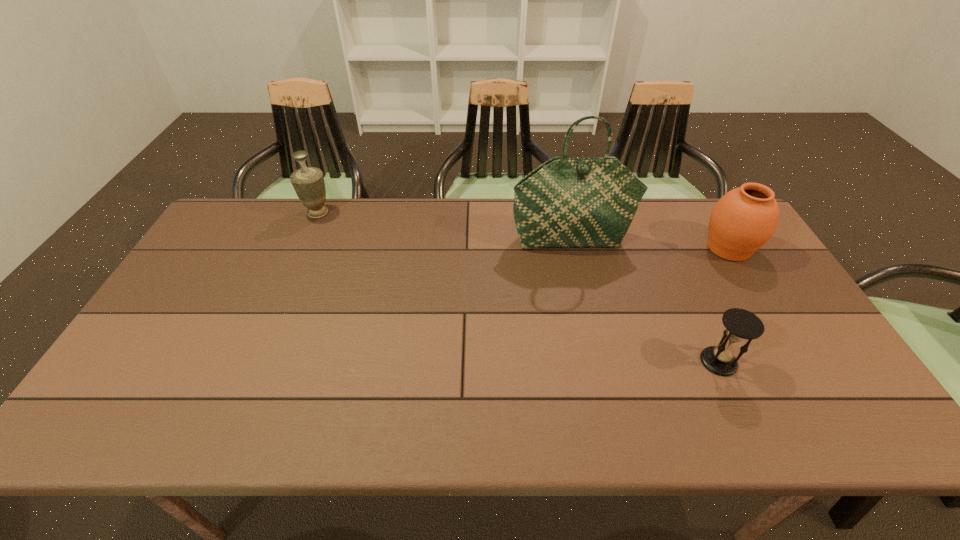
Where is `free space located on the front of the right urn`? This screenshot has width=960, height=540. free space located on the front of the right urn is located at coordinates (777, 328).

At what (x,y) coordinates should I click in order to perform the action: click on free region located on the left of the shortest object. Please return your answer as a coordinate pair (x, y). The height and width of the screenshot is (540, 960). Looking at the image, I should click on (677, 362).

Identify the location of tote bag that is at the far edge. (566, 202).

You are a GUI agent. You are given a task and a screenshot of the screen. Output one action in this format:
    pyautogui.click(x=<x>, y=<y>)
    Task: Click on the object positioned at the right edge
    This screenshot has width=960, height=540.
    Given the screenshot: What is the action you would take?
    pyautogui.click(x=744, y=219)

I want to click on object at the far right corner, so click(x=744, y=219).

Where is `vacant area at the far edge`? The width and height of the screenshot is (960, 540). vacant area at the far edge is located at coordinates (493, 221).

In the image, there is a desktop. At what (x,y) coordinates should I click in order to perform the action: click on vacant region at the near edge. Please return your answer as a coordinate pair (x, y). Image resolution: width=960 pixels, height=540 pixels. Looking at the image, I should click on (441, 406).

Find the location of a particular element. vacant space at the left edge of the desktop is located at coordinates point(251,244).

In the image, there is a desktop. Where is `vacant region at the right edge`? vacant region at the right edge is located at coordinates (774, 309).

This screenshot has height=540, width=960. In the image, there is a desktop. What are the coordinates of `vacant region at the near right corner` in the screenshot? It's located at (858, 430).